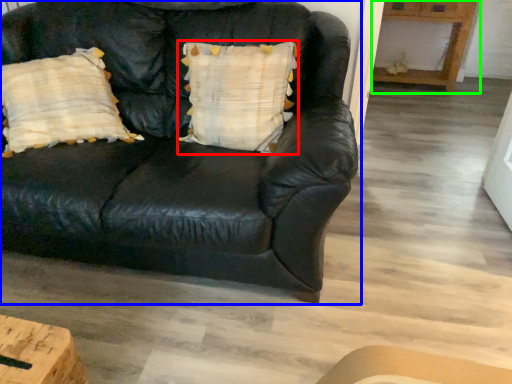
Question: Which object is the closest to the pillow (highlighted by a red box)? Choose among these: studio couch (highlighted by a blue box) or table (highlighted by a green box).

Choices:
 (A) studio couch
 (B) table

Answer: (A)